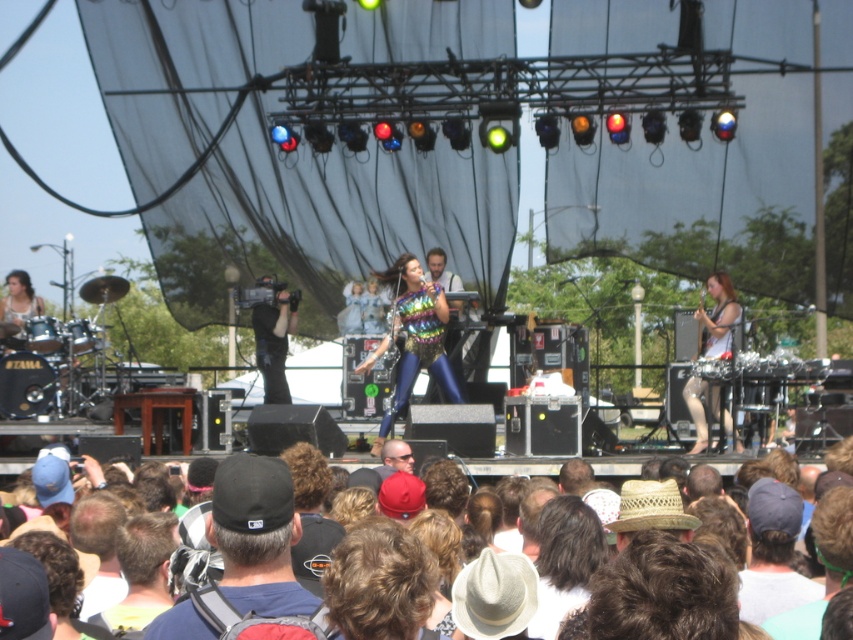
Question: From the image, what is the correct spatial relationship of black fabric cap at center in relation to brown hair at center?

Choices:
 (A) below
 (B) above

Answer: (A)

Question: Which of the following is the farthest from the observer?

Choices:
 (A) black fabric cap at center
 (B) metallic silver microphone at right

Answer: (B)

Question: Can you confirm if brown hair at center is bigger than metallic silver microphone at right?

Choices:
 (A) yes
 (B) no

Answer: (A)

Question: Which object is the farthest from the brown hair at center?

Choices:
 (A) metallic silver microphone at right
 (B) black fabric cap at center

Answer: (A)

Question: Which of these objects is positioned farthest from the brown hair at center?

Choices:
 (A) metallic silver microphone at right
 (B) black fabric cap at center

Answer: (A)

Question: Does black fabric cap at center have a lesser width compared to brown hair at center?

Choices:
 (A) no
 (B) yes

Answer: (B)